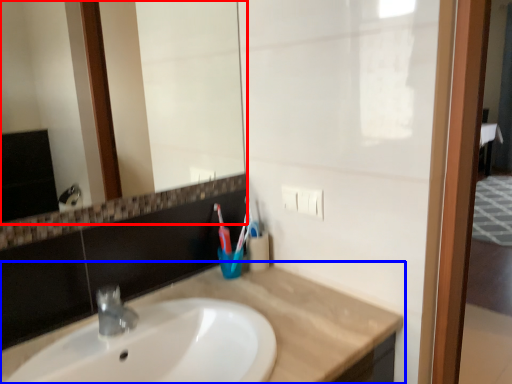
Question: Among these objects, which one is nearest to the camera, mirror (highlighted by a red box) or countertop (highlighted by a blue box)?

Choices:
 (A) mirror
 (B) countertop

Answer: (B)